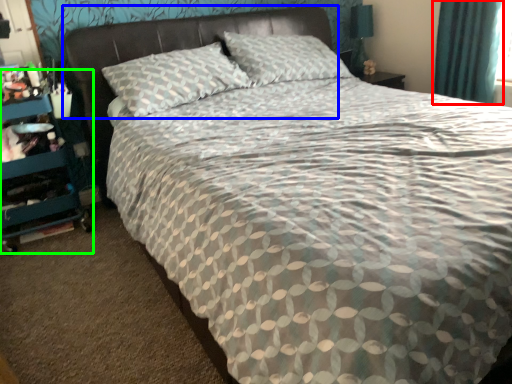
Question: Estimate the real-world distances between objects in this image. Which object is closer to curtain (highlighted by a red box), headboard (highlighted by a blue box) or dresser (highlighted by a green box)?

Choices:
 (A) headboard
 (B) dresser

Answer: (A)